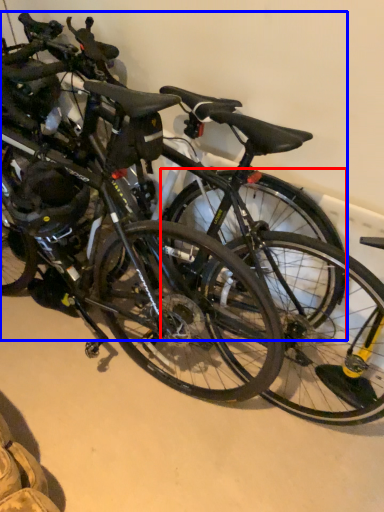
Question: Among these objects, which one is farthest to the camera, bicycle wheel (highlighted by a red box) or bicycle (highlighted by a blue box)?

Choices:
 (A) bicycle wheel
 (B) bicycle

Answer: (A)